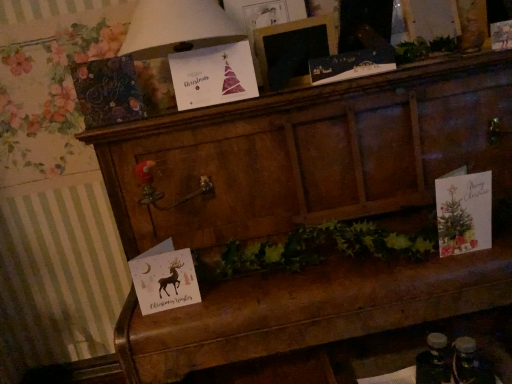
Question: Is wooden picture frame at upper center beside white paper christmas card at upper center?

Choices:
 (A) no
 (B) yes

Answer: (A)

Question: Can white paper christmas card at upper center be found inside wooden picture frame at upper center?

Choices:
 (A) yes
 (B) no

Answer: (B)

Question: From a real-world perspective, does wooden picture frame at upper center stand above white paper christmas card at upper center?

Choices:
 (A) no
 (B) yes

Answer: (A)

Question: Considering the relative positions of wooden picture frame at upper center and white paper christmas card at upper center in the image provided, is wooden picture frame at upper center to the right of white paper christmas card at upper center from the viewer's perspective?

Choices:
 (A) no
 (B) yes

Answer: (B)

Question: Considering the relative positions of wooden picture frame at upper center and white paper christmas card at upper center in the image provided, is wooden picture frame at upper center to the left of white paper christmas card at upper center from the viewer's perspective?

Choices:
 (A) no
 (B) yes

Answer: (A)

Question: From the image's perspective, relative to white paper christmas card at upper center, is matte black card at upper center, the first christmas card from the top, above or below?

Choices:
 (A) above
 (B) below

Answer: (B)

Question: Based on their positions, is matte black card at upper center, the first christmas card from the top, located to the left or right of white paper christmas card at upper center?

Choices:
 (A) left
 (B) right

Answer: (B)

Question: From a real-world perspective, is matte black card at upper center, which is the 4th christmas card in bottom-to-top order, above or below white paper christmas card at upper center?

Choices:
 (A) below
 (B) above

Answer: (A)

Question: Is point pyautogui.click(x=371, y=52) closer or farther from the camera than point pyautogui.click(x=128, y=51)?

Choices:
 (A) closer
 (B) farther

Answer: (B)

Question: Looking at their shapes, would you say white paper christmas card at upper center is wider or thinner than matte white card with reindeer at lower left, marked as the 1th christmas card in a left-to-right arrangement?

Choices:
 (A) thin
 (B) wide

Answer: (B)

Question: From a real-world perspective, is white paper christmas card at upper center positioned above or below matte white card with reindeer at lower left, which ranks as the fourth christmas card in right-to-left order?

Choices:
 (A) above
 (B) below

Answer: (A)

Question: Considering their positions, is white paper christmas card at upper center located in front of or behind matte white card with reindeer at lower left, placed as the fourth christmas card when sorted from top to bottom?

Choices:
 (A) behind
 (B) front

Answer: (B)

Question: From their relative heights in the image, would you say white paper christmas card at upper center is taller or shorter than matte white card with reindeer at lower left, arranged as the first christmas card when ordered from the bottom?

Choices:
 (A) short
 (B) tall

Answer: (B)

Question: In terms of width, does matte paper card at right, the first christmas card from the right, look wider or thinner when compared to matte white card with reindeer at lower left, placed as the fourth christmas card when sorted from top to bottom?

Choices:
 (A) wide
 (B) thin

Answer: (B)

Question: Choose the correct answer: Is matte paper card at right, the first christmas card from the right, inside matte white card with reindeer at lower left, marked as the 1th christmas card in a left-to-right arrangement, or outside it?

Choices:
 (A) outside
 (B) inside

Answer: (A)